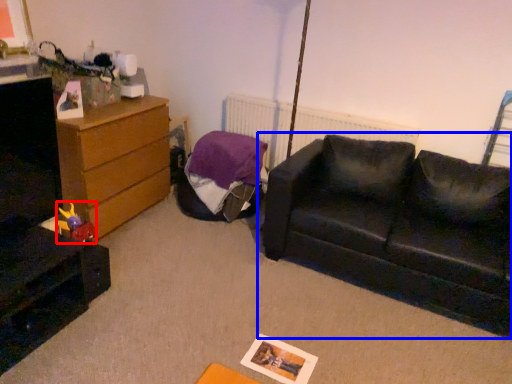
Question: Which of the following is the farthest to the observer, toy (highlighted by a red box) or studio couch (highlighted by a blue box)?

Choices:
 (A) toy
 (B) studio couch

Answer: (A)